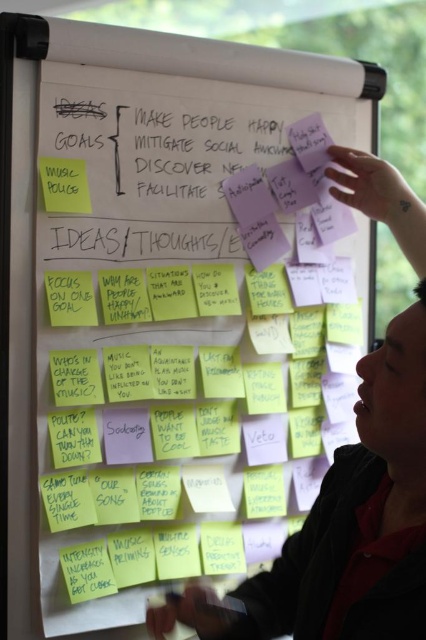
Can you confirm if dark skin at upper right is smaller than yellow sticky note at left?

Incorrect, dark skin at upper right is not smaller in size than yellow sticky note at left.

Can you confirm if dark skin at upper right is shorter than yellow sticky note at left?

In fact, dark skin at upper right may be taller than yellow sticky note at left.

Is point (417, 380) behind point (52, 196)?

No, (417, 380) is in front of (52, 196).

Find the location of a particular element. The image size is (426, 640). dark skin at upper right is located at coordinates (351, 477).